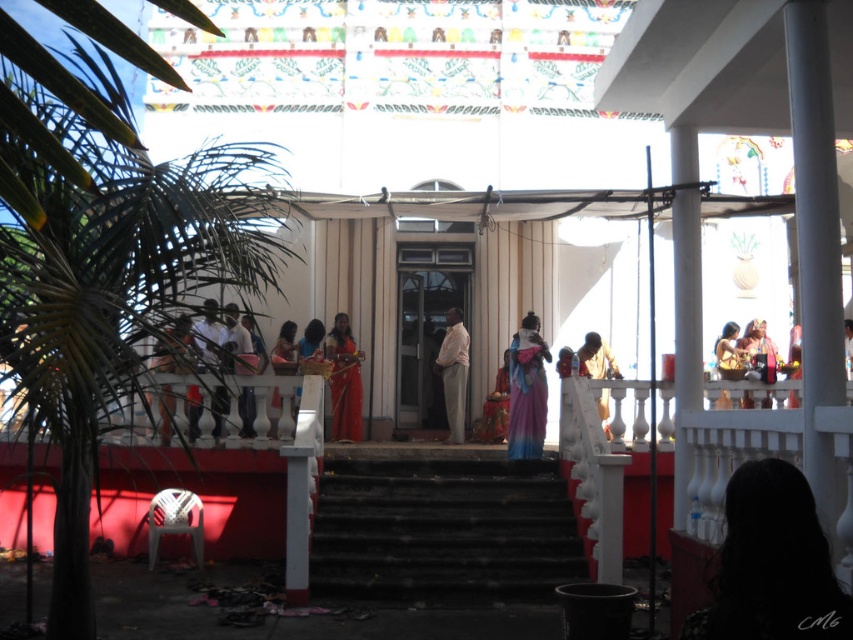
Question: Is purple silk saree at center below matte pink saree at right?

Choices:
 (A) yes
 (B) no

Answer: (A)

Question: Which point is farther to the camera?

Choices:
 (A) (816, 625)
 (B) (724, 406)

Answer: (B)

Question: Is satin red saree at center to the right of matte pink saree at upper right from the viewer's perspective?

Choices:
 (A) yes
 (B) no

Answer: (B)

Question: Which point is closer to the camera?

Choices:
 (A) matte pink saree at upper right
 (B) blue silk saree at center

Answer: (A)

Question: Is blue silk saree at center further to the viewer compared to matte pink saree at right?

Choices:
 (A) no
 (B) yes

Answer: (B)

Question: Which object is positioned farthest from the matte pink saree at upper right?

Choices:
 (A) blue silk saree at center
 (B) matte white statue at center
 (C) purple silk saree at center

Answer: (A)